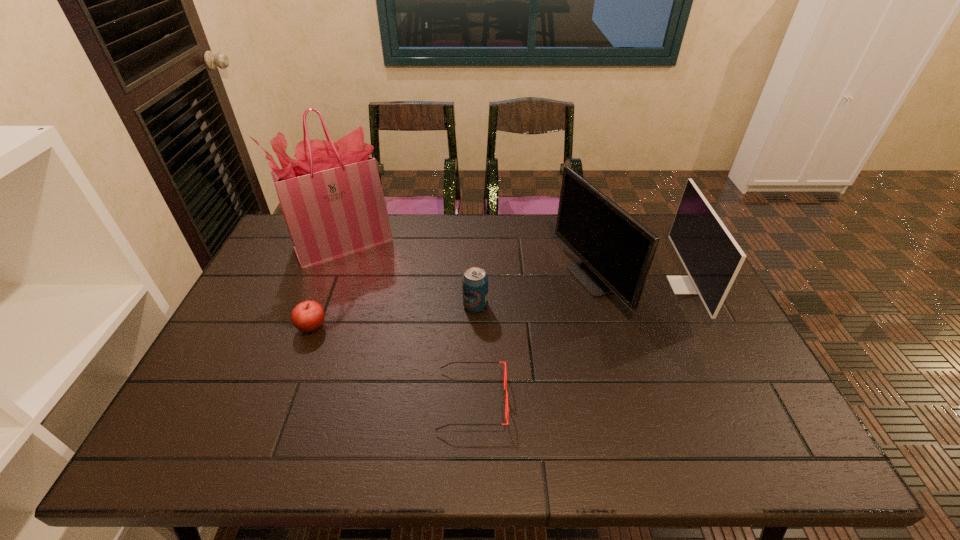
Locate an element on the screen. This screenshot has height=540, width=960. object present at the right edge is located at coordinates (712, 258).

Where is `object positioned at the far left corner`? The image size is (960, 540). object positioned at the far left corner is located at coordinates (331, 197).

Find the location of a particular element. The image size is (960, 540). object at the far right corner is located at coordinates (712, 258).

In the image, there is a desktop. At what (x,y) coordinates should I click in order to perform the action: click on vacant space at the far edge. Please return your answer as a coordinate pair (x, y). The width and height of the screenshot is (960, 540). Looking at the image, I should click on (490, 236).

What are the coordinates of `free spot at the near edge of the desktop` in the screenshot? It's located at (585, 438).

The image size is (960, 540). I want to click on vacant area at the left edge, so point(195,398).

Identify the location of free space at the right edge. (722, 322).

At what (x,y) coordinates should I click in order to perform the action: click on free space between the second object from right to left and the fourth tallest object. Please return your answer as a coordinate pair (x, y). The width and height of the screenshot is (960, 540). Looking at the image, I should click on (533, 293).

Identify the location of unoccupied area between the fifth object from left to right and the fourth tallest object. This screenshot has width=960, height=540. (533, 293).

This screenshot has height=540, width=960. I want to click on empty space that is in between the left monitor and the nearest object, so click(x=531, y=340).